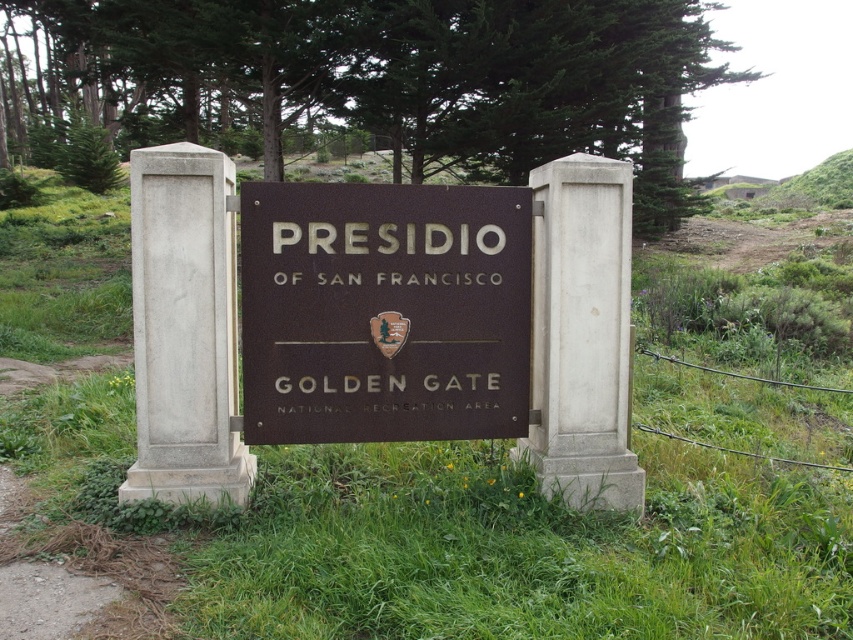
Question: Observing the image, what is the correct spatial positioning of brown polished wood sign at center in reference to wire/fabric at lower right?

Choices:
 (A) below
 (B) above

Answer: (B)

Question: Can you confirm if brown polished wood sign at center is positioned to the right of wire/fabric at lower right?

Choices:
 (A) yes
 (B) no

Answer: (B)

Question: Which point appears farthest from the camera in this image?

Choices:
 (A) tap(799, 385)
 (B) tap(247, 385)

Answer: (A)

Question: Is brown polished wood sign at center thinner than wire/fabric at lower right?

Choices:
 (A) yes
 (B) no

Answer: (B)